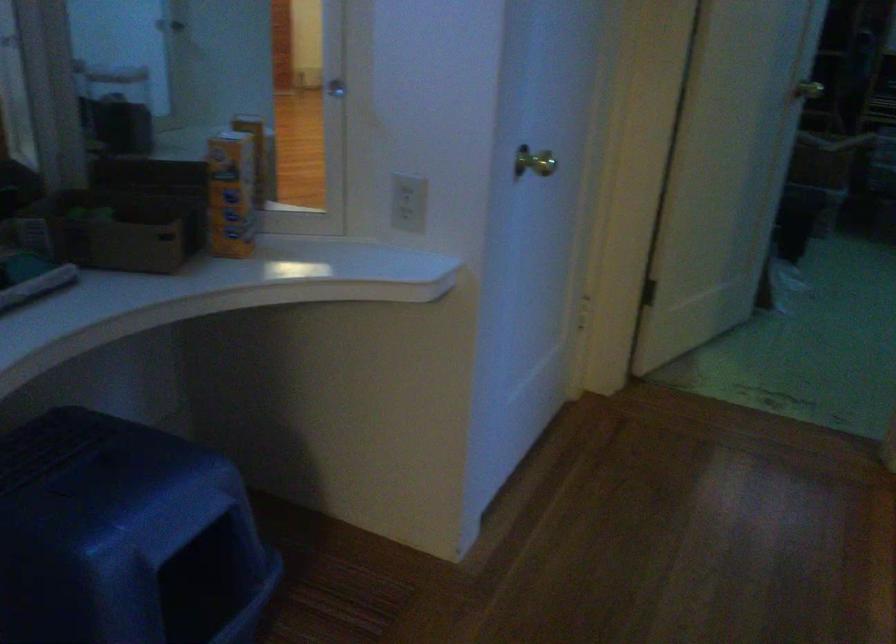
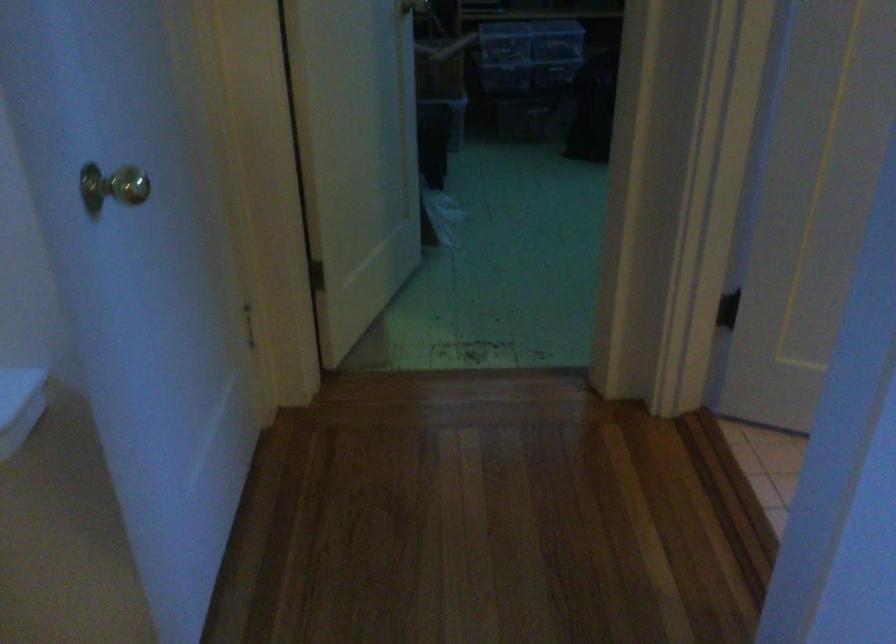
Question: Based on the continuous images, in which direction is the camera rotating? Reply with the corresponding letter.

Choices:
 (A) Left
 (B) Right
 (C) Up
 (D) Down

Answer: (B)